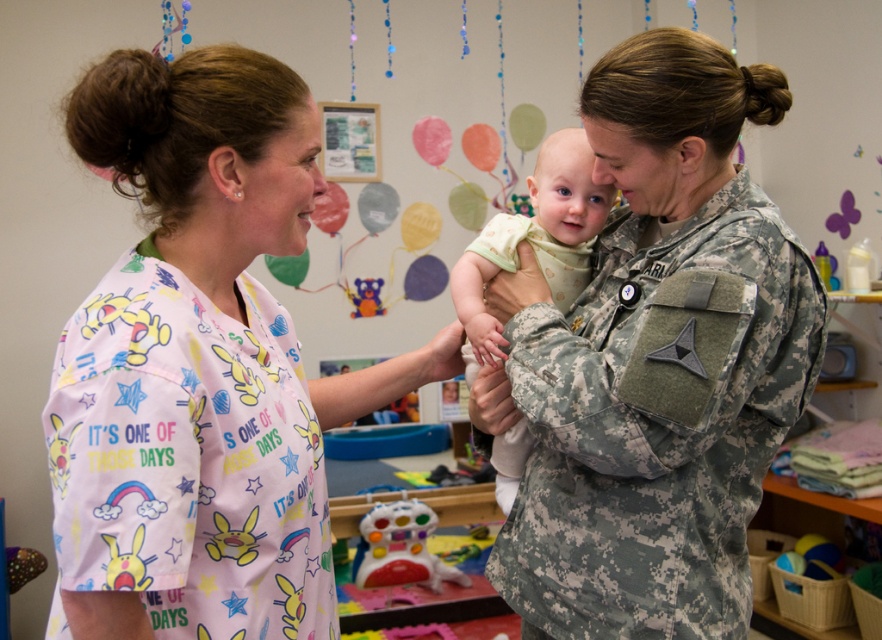
Question: Is pink fabric shirt at left closer to the viewer compared to pink fabric scrub top at left?

Choices:
 (A) no
 (B) yes

Answer: (A)

Question: Which of these objects is positioned closest to the camouflage fabric uniform at center?

Choices:
 (A) multicolored plastic toy at center
 (B) pink fabric shirt at left
 (C) light green fabric baby at center
 (D) pink fabric scrub top at left

Answer: (C)

Question: Which is nearer to the light green fabric baby at center?

Choices:
 (A) camouflage fabric uniform at center
 (B) multicolored plastic toy at center

Answer: (A)

Question: Considering the relative positions of pink fabric shirt at left and pink fabric scrub top at left in the image provided, where is pink fabric shirt at left located with respect to pink fabric scrub top at left?

Choices:
 (A) right
 (B) left

Answer: (A)

Question: Does pink fabric shirt at left have a larger size compared to multicolored plastic toy at center?

Choices:
 (A) no
 (B) yes

Answer: (B)

Question: Considering the real-world distances, which object is closest to the pink fabric scrub top at left?

Choices:
 (A) light green fabric baby at center
 (B) pink fabric shirt at left
 (C) camouflage fabric uniform at center
 (D) multicolored plastic toy at center

Answer: (B)